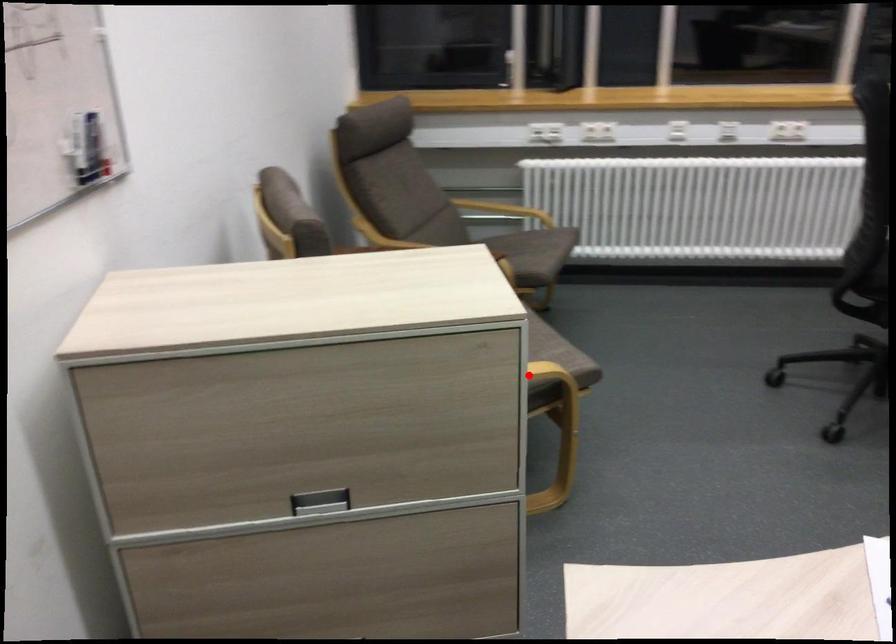
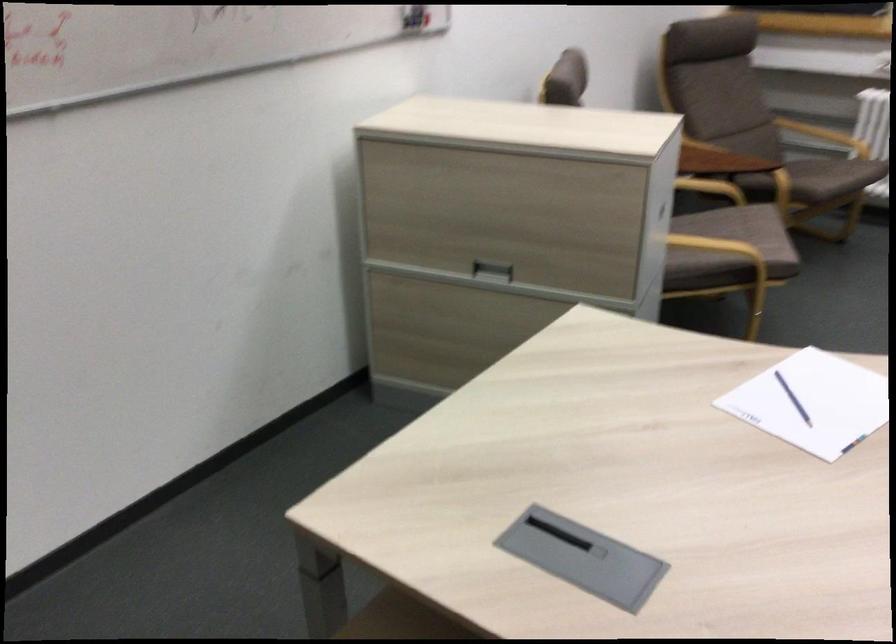
Find the pixel in the second image that matches the highlighted location in the first image.

(721, 249)